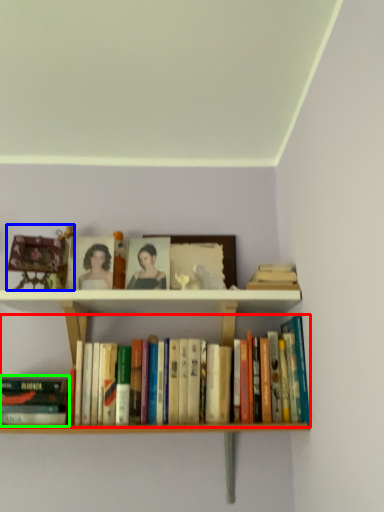
Question: Which object is the farthest from book (highlighted by a red box)? Choose among these: toy (highlighted by a blue box) or book (highlighted by a green box).

Choices:
 (A) toy
 (B) book

Answer: (A)